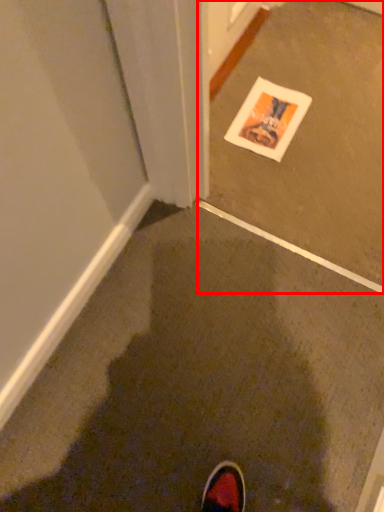
Question: From the image's perspective, where is concrete (annotated by the red box) located relative to mud?

Choices:
 (A) below
 (B) above

Answer: (B)